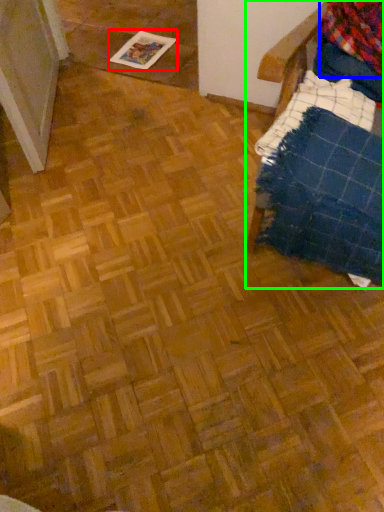
Question: Based on their relative distances, which object is farther from magazine (highlighted by a red box)? Choose from flannel (highlighted by a blue box) and furniture (highlighted by a green box).

Choices:
 (A) flannel
 (B) furniture

Answer: (B)